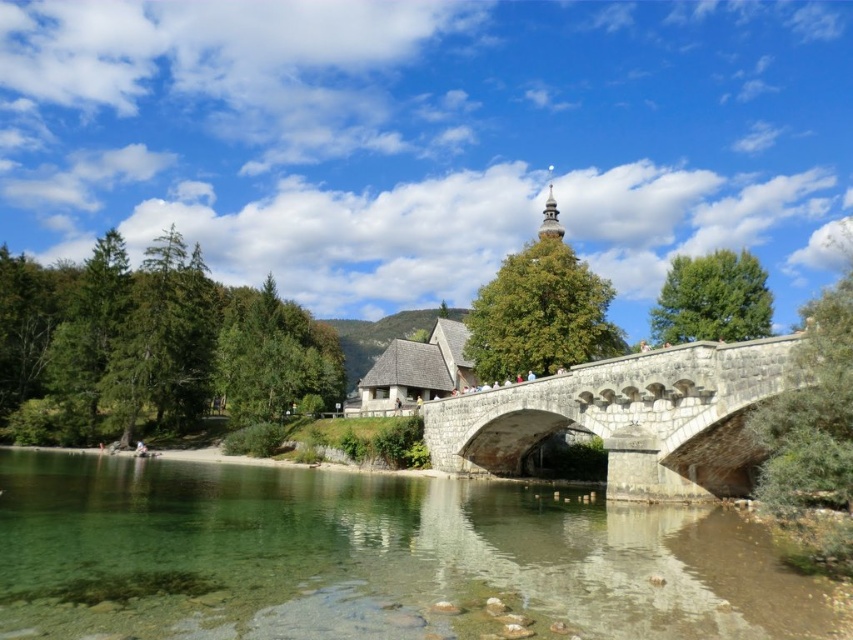
You are a tourist standing on the stone bridge at center and looking towards the clear water at river right. Which object appears taller from your perspective?

The stone bridge at center appears taller than the clear water at river right because the clear water at river right is shorter than the stone bridge at center.

Looking at this image, you are standing at the stone bridge and looking towards the traditional building. There are two points marked on the bridge surface. One is at coordinate point (701, 632) and the other at point (525, 451). Which point is nearer to you?

Point (701, 632) is closer to the camera than point (525, 451), so the point at (701, 632) is nearer to you.

You are standing on the stone bridge and looking towards the traditional building. Where is the clear water at river right located relative to your position?

The clear water at river right is located at the 2D coordinate point of [370,557] relative to your position on the stone bridge.